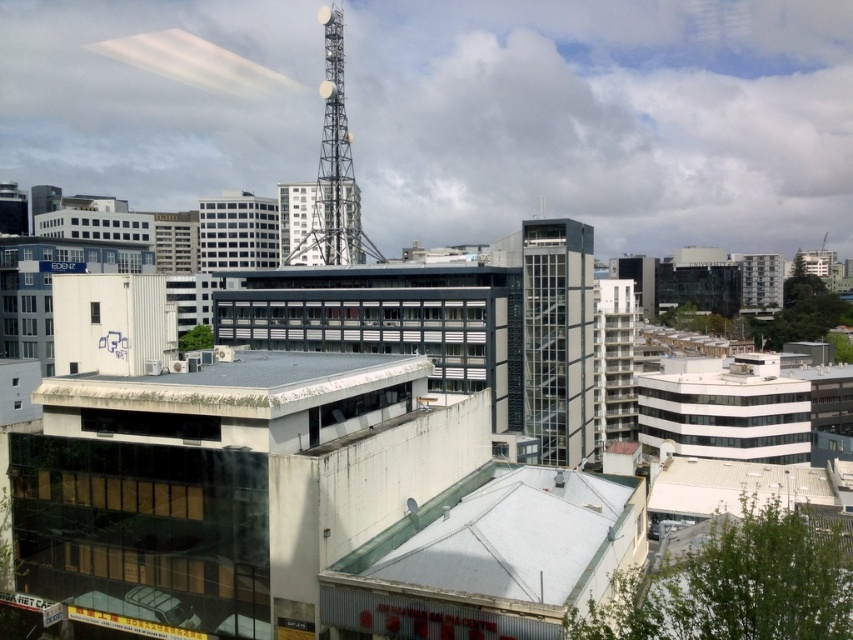
You are a city planner assessing the distance between two landmarks in the scene. The glassy steel building at center and the white weathered roof at lower left are both important for urban planning. Can you determine if the distance between them is sufficient to allow a new pedestrian walkway that requires at least 30 meters of space?

The glassy steel building at center and the white weathered roof at lower left are 37.07 meters apart, which is more than the required 30 meters. Therefore, the distance is sufficient to accommodate the new pedestrian walkway.

You are a city planner reviewing the cityscape. You notice the white weathered roof at lower left and the metallic tower at upper center. Which of these two structures is located higher up in the image?

The metallic tower at upper center is located higher up in the image than the white weathered roof at lower left.

You are an urban planner assessing the city layout. Based on the scene, which object takes up more visual space in the image between the white weathered roof at lower left and the metallic tower at upper center?

The metallic tower at upper center occupies more visual space than the white weathered roof at lower left according to the description.